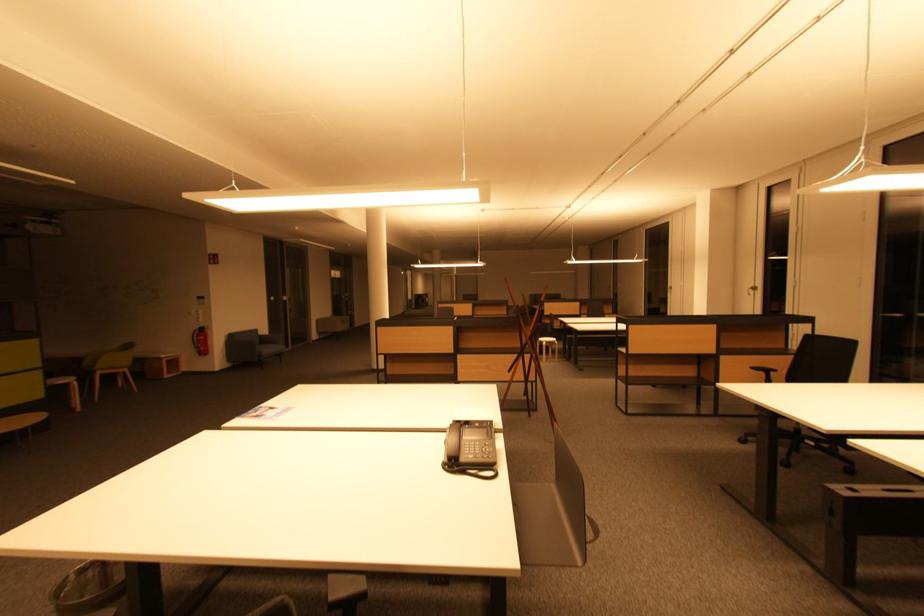
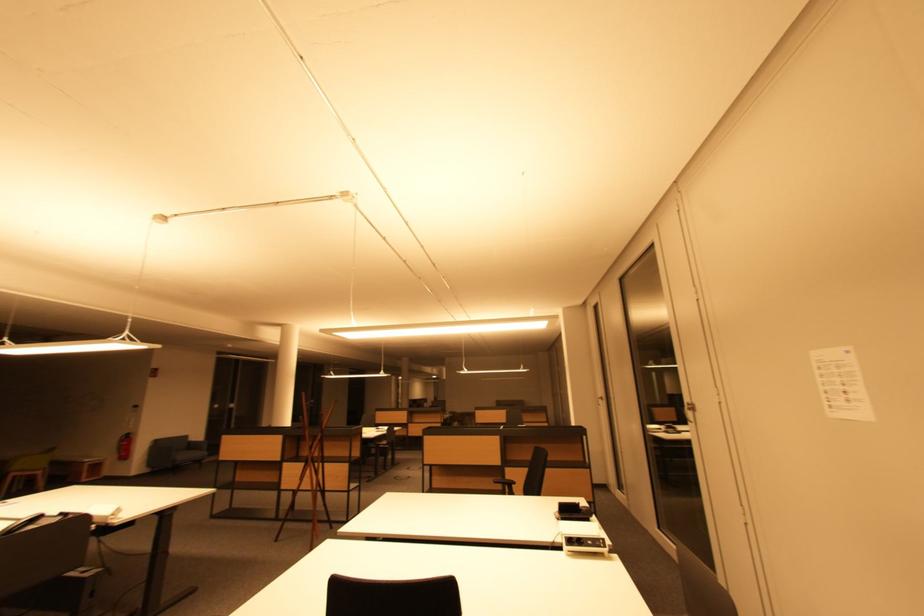
Where in the second image is the point corresponding to point 207,353 from the first image?

(128, 458)